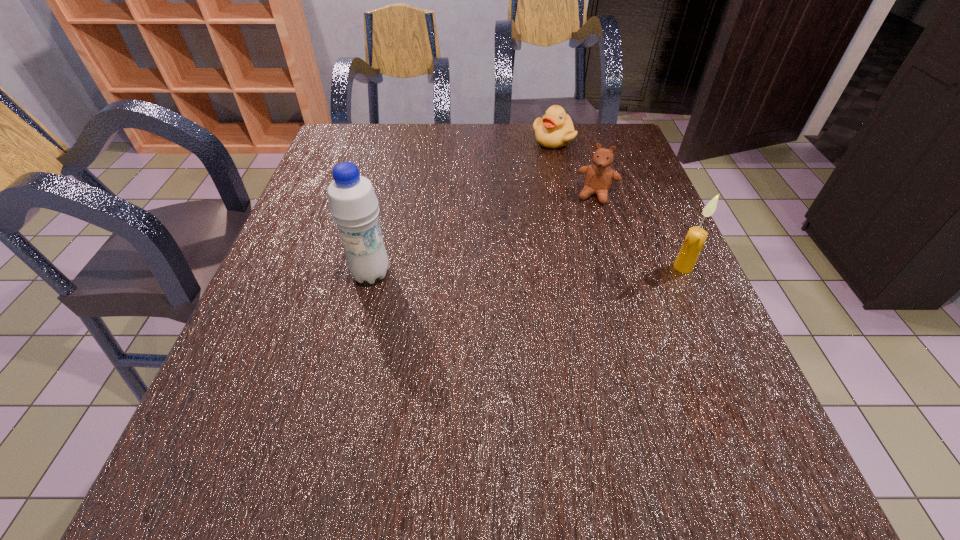
I want to click on water bottle, so click(353, 204).

Identify the location of the leftmost object. This screenshot has height=540, width=960. pyautogui.click(x=353, y=204).

The image size is (960, 540). I want to click on the rightmost object, so click(x=695, y=239).

Locate an element on the screen. This screenshot has height=540, width=960. the second tallest object is located at coordinates tap(695, 239).

Where is `the third nearest object`? This screenshot has height=540, width=960. the third nearest object is located at coordinates (598, 177).

You are a GUI agent. You are given a task and a screenshot of the screen. Output one action in this format:
    pyautogui.click(x=<x>, y=<y>)
    Task: Click on the second shortest object
    This screenshot has height=540, width=960.
    Given the screenshot: What is the action you would take?
    pyautogui.click(x=598, y=177)

This screenshot has width=960, height=540. In order to click on the farthest object in this screenshot , I will do `click(555, 130)`.

This screenshot has height=540, width=960. I want to click on the shortest object, so coord(555,130).

In order to click on free location located 0.190m on the back of the leftmost object in this screenshot , I will do [387, 206].

At what (x,y) coordinates should I click in order to perform the action: click on vacant space located on the front of the third shortest object. Please return your answer as a coordinate pair (x, y). Looking at the image, I should click on (705, 314).